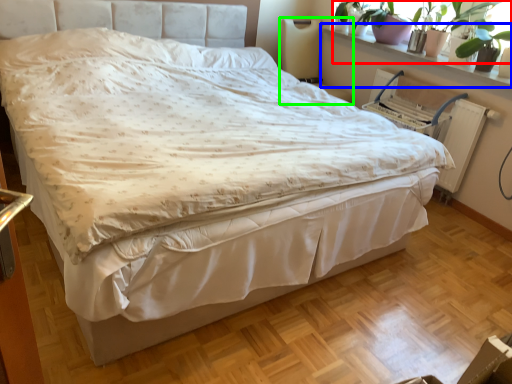
Question: Considering the real-world distances, which object is closest to plant (highlighted by a red box)? window sill (highlighted by a blue box) or swivel chair (highlighted by a green box).

Choices:
 (A) window sill
 (B) swivel chair

Answer: (A)